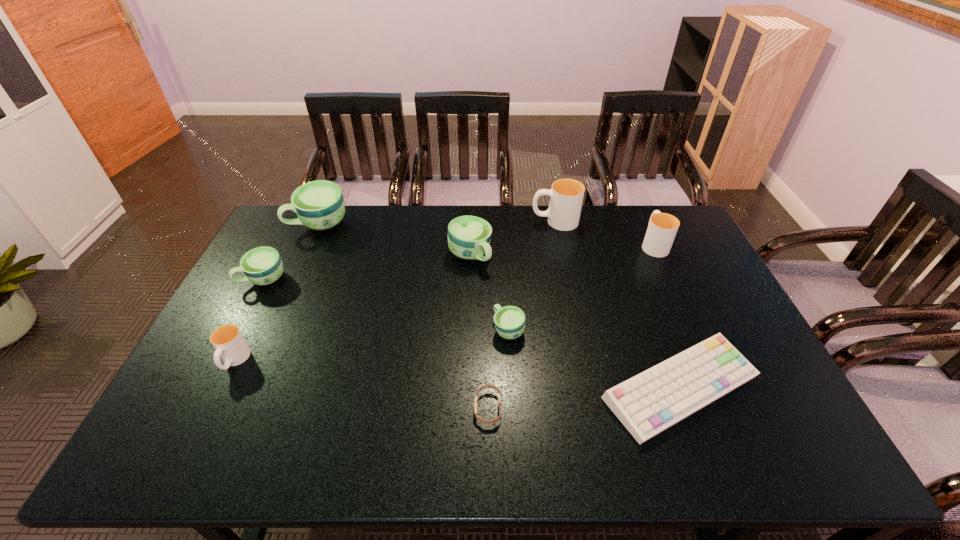
The image size is (960, 540). In order to click on the farthest yellow cup in this screenshot , I will do `click(566, 195)`.

Identify the location of the biggest yellow cup. The width and height of the screenshot is (960, 540). (566, 195).

Locate an element on the screen. This screenshot has height=540, width=960. the farthest blue cup is located at coordinates (319, 205).

Image resolution: width=960 pixels, height=540 pixels. Find the location of `the rightmost cup`. the rightmost cup is located at coordinates (662, 228).

The image size is (960, 540). I want to click on the second farthest yellow cup, so click(662, 228).

Identify the location of the third smallest blue cup. (469, 237).

Identify the location of the third biggest blue cup. 263,265.

You are a GUI agent. You are given a task and a screenshot of the screen. Output one action in this format:
    pyautogui.click(x=<x>, y=<y>)
    Task: Click on the smallest yellow cup
    The width and height of the screenshot is (960, 540).
    Given the screenshot: What is the action you would take?
    pyautogui.click(x=228, y=341)

Where is `the leftmost yellow cup`? The height and width of the screenshot is (540, 960). the leftmost yellow cup is located at coordinates (228, 341).

You are a GUI agent. You are given a task and a screenshot of the screen. Output one action in this format:
    pyautogui.click(x=<x>, y=<y>)
    Task: Click on the second nearest cup
    This screenshot has height=540, width=960.
    Given the screenshot: What is the action you would take?
    pyautogui.click(x=509, y=321)